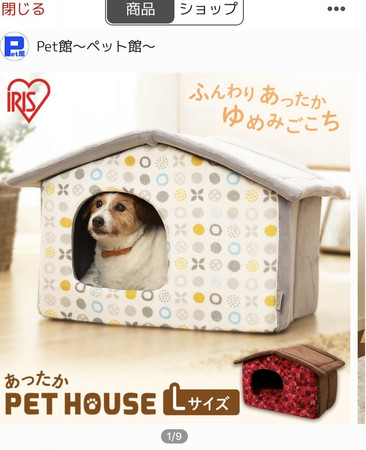
You are a GUI agent. You are given a task and a screenshot of the screen. Output one action in this format:
    pyautogui.click(x=<x>, y=<y>)
    Task: Click on the window
    Image resolution: width=366 pixels, height=450 pixels.
    Given the screenshot: What is the action you would take?
    pyautogui.click(x=66, y=117)